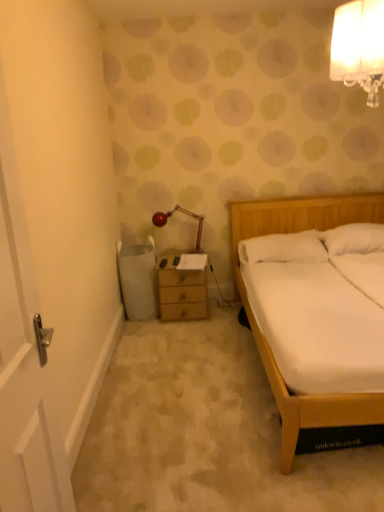
What are the coordinates of `free space in front of wooden chest of drawers at center` in the screenshot? It's located at (183, 333).